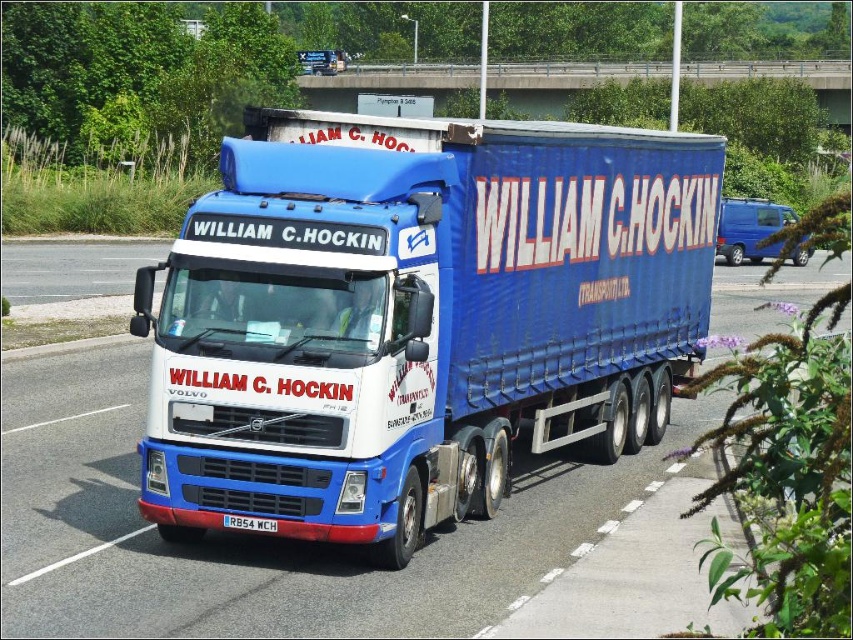
You are a delivery driver who needs to park the blue fabric trailer truck at center in a parking lot. The parking spot is located at point coordinates of 0.5, 0.5. Is the truck currently positioned close enough to the parking spot?

The blue fabric trailer truck at center is located at point coordinates of (x=416, y=317), which is very close to the parking spot at (x=426, y=320). The truck is positioned close enough to the parking spot.

You are standing at the point with coordinates point (x=328, y=77) and want to walk towards the point (x=431, y=538). Based on the scene, which direction should you face to move towards the correct point?

Since point (x=431, y=538) is in front of point (x=328, y=77), you should face forward to move towards it.